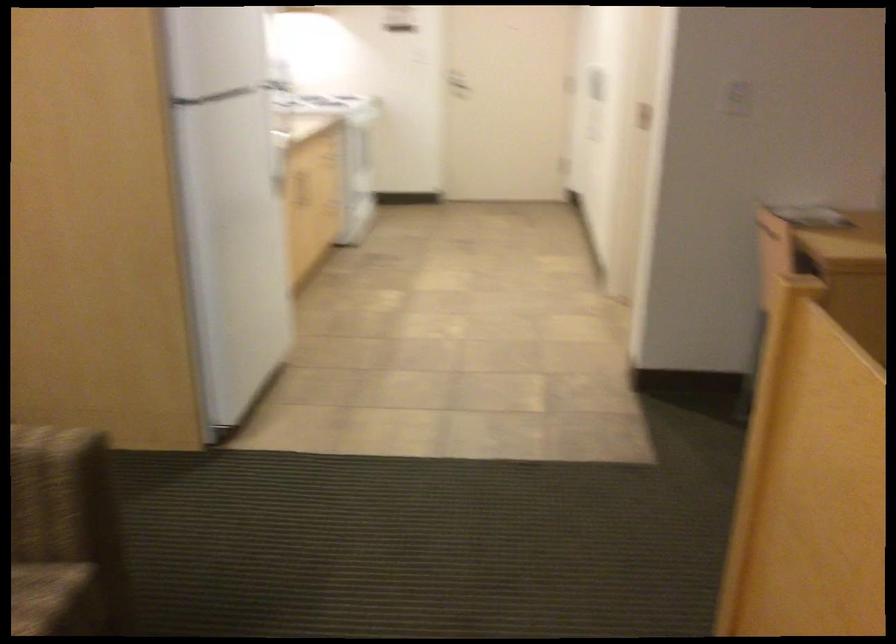
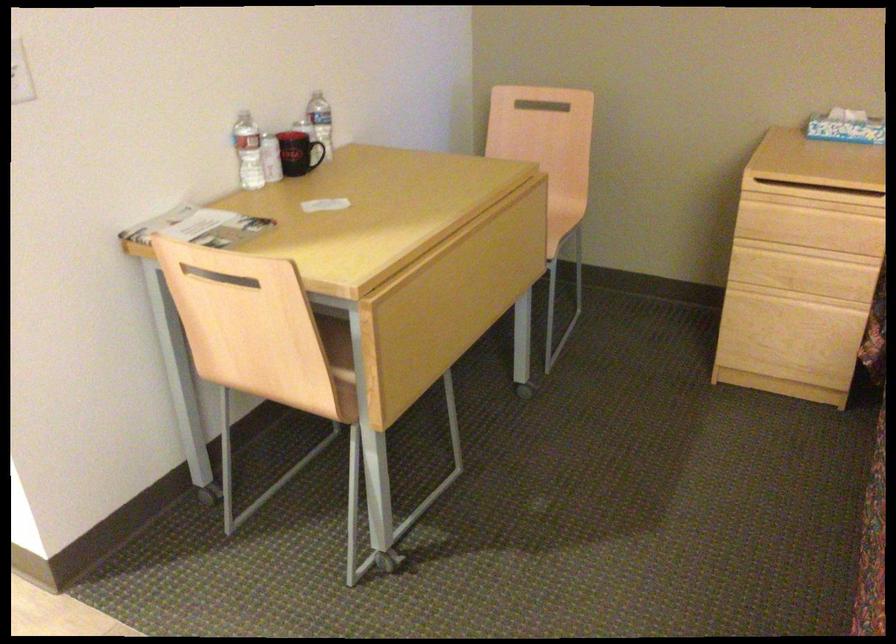
Where in the second image is the point corresponding to point (797, 240) from the first image?

(220, 277)